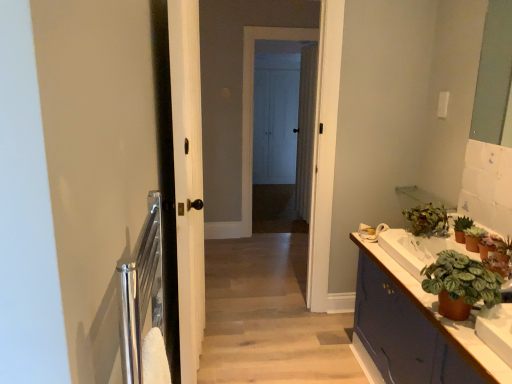
Question: Is matte purple cabinet at right beside green matte plant at right, the 4th houseplant viewed from the back?

Choices:
 (A) yes
 (B) no

Answer: (B)

Question: Can you confirm if matte purple cabinet at right is positioned to the right of green matte plant at right, the 4th houseplant viewed from the back?

Choices:
 (A) no
 (B) yes

Answer: (A)

Question: Is matte purple cabinet at right taller than green matte plant at right, the 2th houseplant when ordered from front to back?

Choices:
 (A) yes
 (B) no

Answer: (A)

Question: Is matte purple cabinet at right at the left side of green matte plant at right, the 2th houseplant when ordered from front to back?

Choices:
 (A) yes
 (B) no

Answer: (A)

Question: From the image's perspective, is matte purple cabinet at right beneath green matte plant at right, the 2th houseplant when ordered from front to back?

Choices:
 (A) yes
 (B) no

Answer: (A)

Question: Based on their positions, is white textured curtain at center located to the left or right of white wood screen door at center, the first screen door from the back?

Choices:
 (A) right
 (B) left

Answer: (A)

Question: From the image's perspective, relative to white wood screen door at center, the first screen door from the back, is white textured curtain at center above or below?

Choices:
 (A) above
 (B) below

Answer: (B)

Question: Is white textured curtain at center spatially inside white wood screen door at center, the first screen door from the back, or outside of it?

Choices:
 (A) inside
 (B) outside

Answer: (B)

Question: In terms of width, does white textured curtain at center look wider or thinner when compared to white wood screen door at center, the first screen door from the back?

Choices:
 (A) thin
 (B) wide

Answer: (B)

Question: Is point (457, 231) closer or farther from the camera than point (437, 269)?

Choices:
 (A) closer
 (B) farther

Answer: (B)

Question: From a real-world perspective, relative to green matte plant at right, arranged as the 1th houseplant when viewed from the front, is green matte plant at right, placed as the second houseplant when sorted from back to front, vertically above or below?

Choices:
 (A) below
 (B) above

Answer: (A)

Question: Would you say green matte plant at right, arranged as the 4th houseplant when viewed from the front, is to the left or to the right of green matte plant at right, arranged as the 1th houseplant when viewed from the front, in the picture?

Choices:
 (A) left
 (B) right

Answer: (B)

Question: Is green matte plant at right, arranged as the 4th houseplant when viewed from the front, in front of or behind green matte plant at right, acting as the 5th houseplant starting from the back, in the image?

Choices:
 (A) behind
 (B) front

Answer: (A)

Question: Is green matte plant at right, the 2th houseplant when ordered from front to back, wider or thinner than matte purple cabinet at right?

Choices:
 (A) wide
 (B) thin

Answer: (B)

Question: Would you say green matte plant at right, the 4th houseplant viewed from the back, is to the left or to the right of matte purple cabinet at right in the picture?

Choices:
 (A) right
 (B) left

Answer: (A)